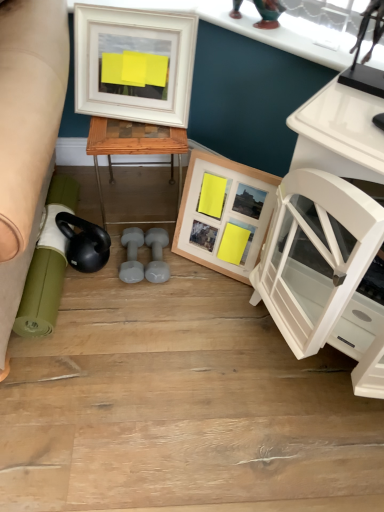
Find the location of `free space in front of white matte picture frame at upper left, which is the second picture frame from bottom to top`. free space in front of white matte picture frame at upper left, which is the second picture frame from bottom to top is located at coordinates (133, 136).